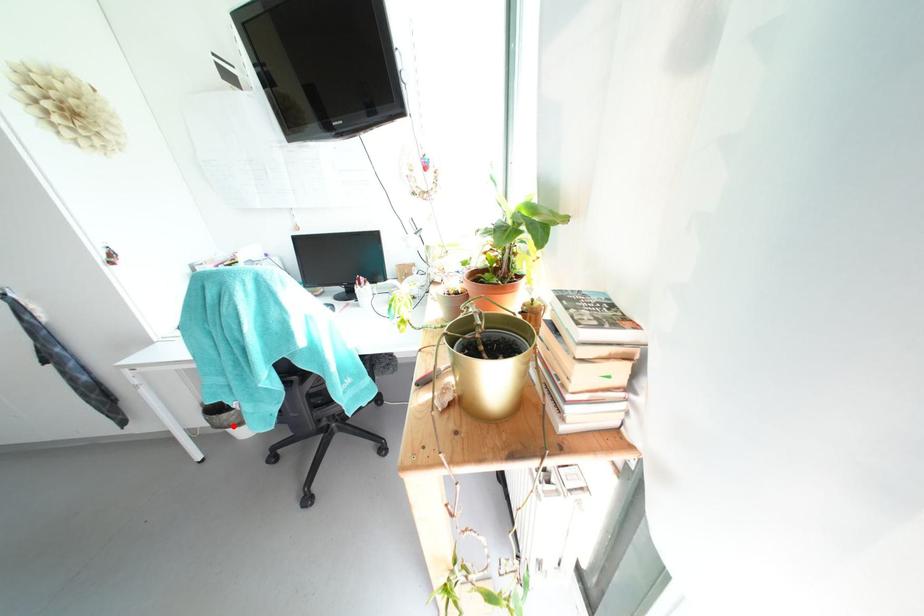
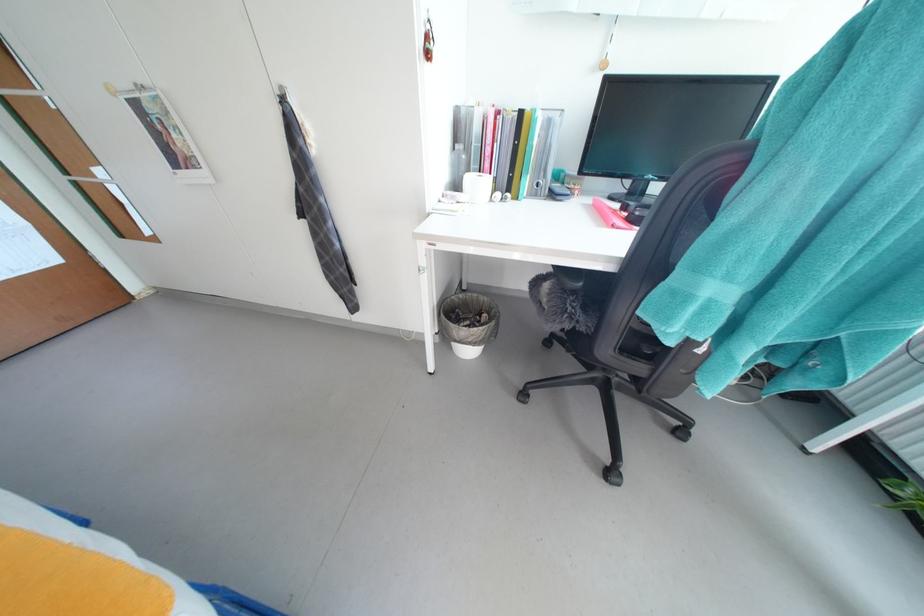
Find the pixel in the second image that matches the highlighted location in the first image.

(478, 342)